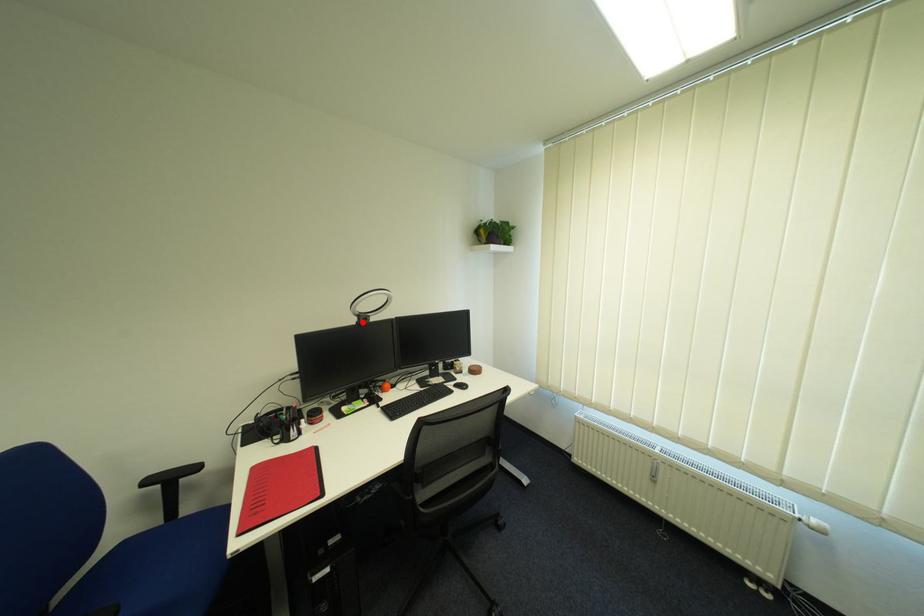
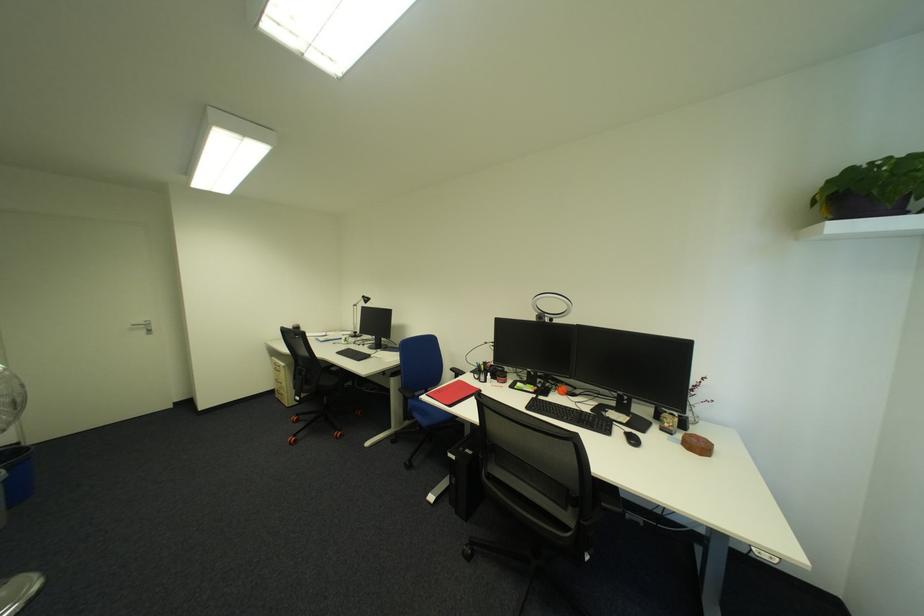
Locate, in the second image, the point that corresponds to the highlighted location in the first image.

(542, 318)